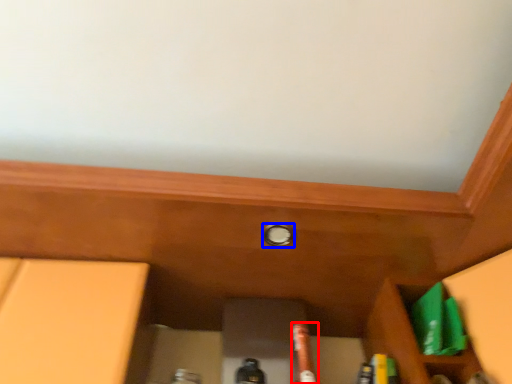
Question: Which object is closer to the camera taking this photo, beer bottle (highlighted by a red box) or knob (highlighted by a blue box)?

Choices:
 (A) beer bottle
 (B) knob

Answer: (A)